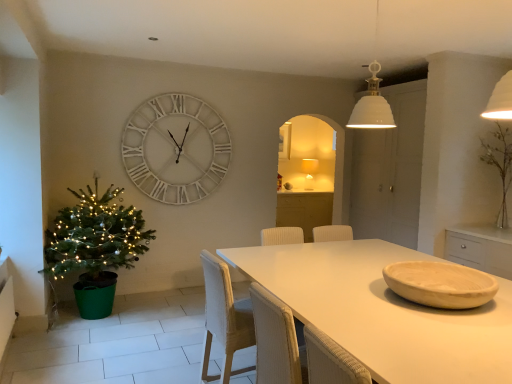
Question: From a real-world perspective, is green plastic christmas tree at left physically located above or below matte beige bowl at table center?

Choices:
 (A) above
 (B) below

Answer: (B)

Question: Considering the positions of point (113, 279) and point (466, 276), is point (113, 279) closer or farther from the camera than point (466, 276)?

Choices:
 (A) farther
 (B) closer

Answer: (A)

Question: Which object is positioned closest to the woven beige armchair at center?

Choices:
 (A) matte beige bowl at table center
 (B) woven white chair at center
 (C) green plastic christmas tree at left
 (D) matte white lampshade at center
 (E) white wooden clock at upper center

Answer: (B)

Question: Which is farther from the woven white chair at center?

Choices:
 (A) white wooden clock at upper center
 (B) white matte table at center
 (C) matte beige bowl at table center
 (D) matte white lampshade at center
 (E) green plastic christmas tree at left

Answer: (D)